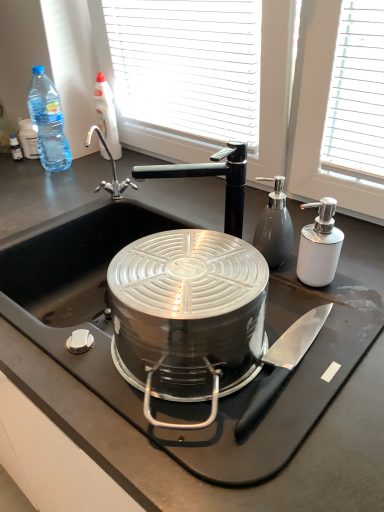
The width and height of the screenshot is (384, 512). Identify the location of free space above black matte countertop at center (from a real-world perspective). (187, 223).